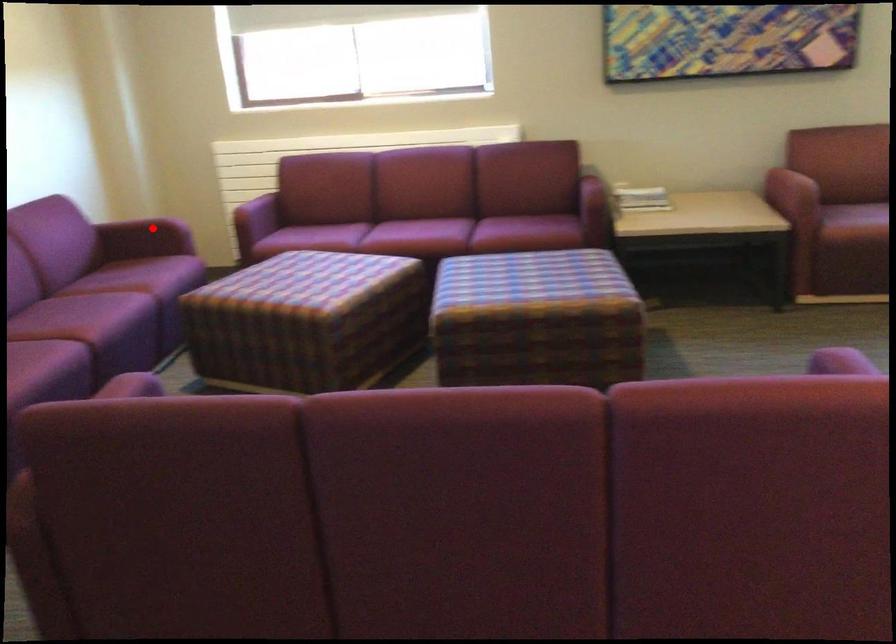
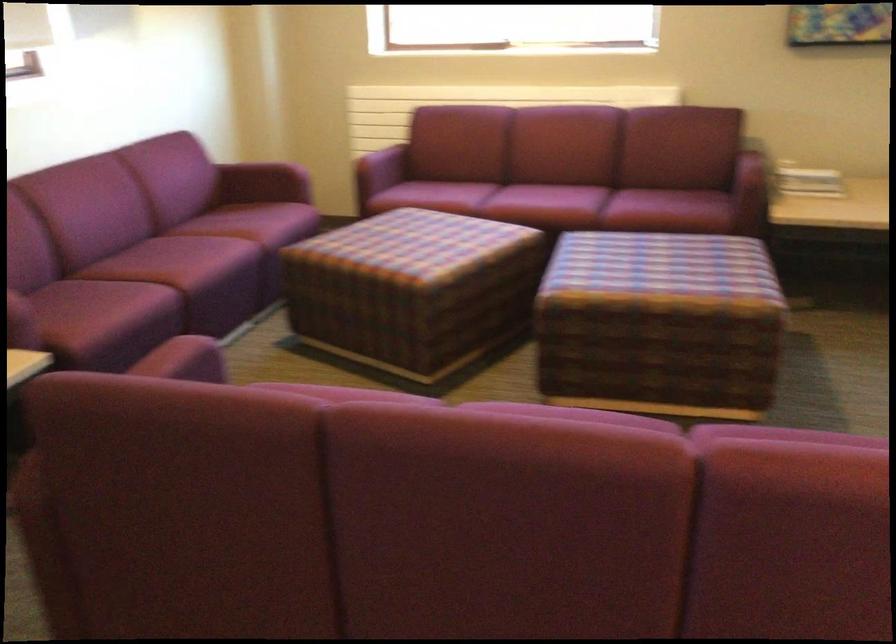
The point at the highlighted location is marked in the first image. Where is the corresponding point in the second image?

(269, 173)